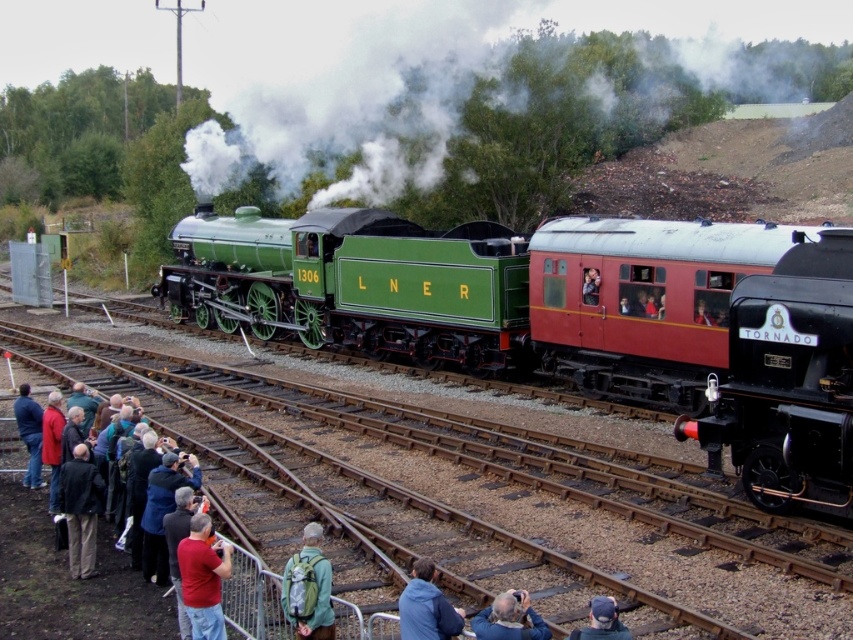
You are a photographer at the railway station. You want to take a photo of the polished black steam locomotive at right and the blue fabric jacket at lower center. Which object should you focus on first to ensure it appears sharp in the photo?

You should focus on the polished black steam locomotive at right first because it is closer to you than the blue fabric jacket at lower center, so it will be in focus first.

You are a photographer at the railway station. You want to capture a photo that includes both the white vapor steam at upper center and the red cotton shirt at lower left. Based on their positions, will the steam appear above the shirt in the photo?

Yes, the white vapor steam at upper center is above the red cotton shirt at lower left, so in the photo, the steam will appear above the shirt.